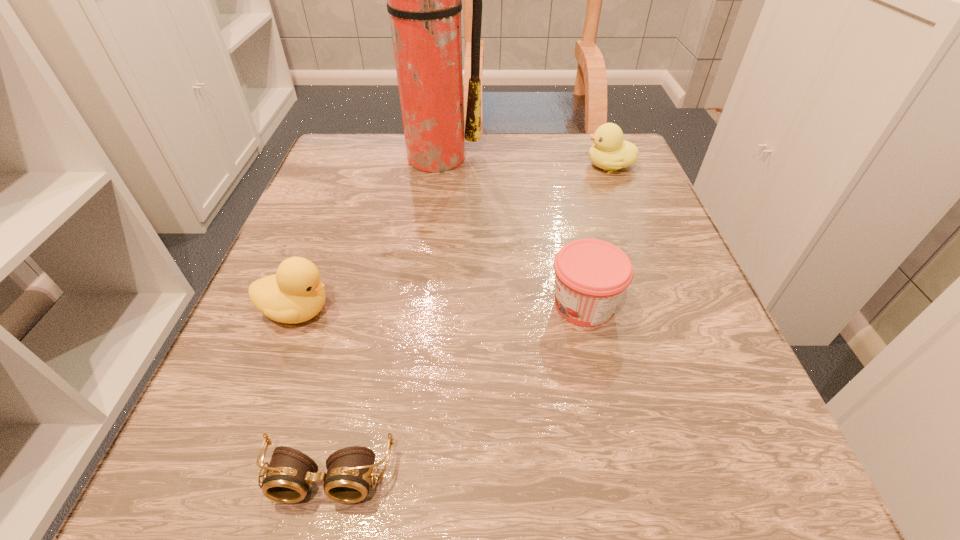
This screenshot has width=960, height=540. What are the coordinates of `duckling present at the right edge` in the screenshot? It's located at (610, 152).

The image size is (960, 540). I want to click on jam that is at the right edge, so click(591, 275).

At what (x,y) coordinates should I click in order to perform the action: click on object present at the far left corner. Please return your answer as a coordinate pair (x, y). The image size is (960, 540). Looking at the image, I should click on (424, 0).

Find the location of a particular element. Image resolution: width=960 pixels, height=540 pixels. object that is at the near left corner is located at coordinates (288, 478).

Locate an element on the screen. The height and width of the screenshot is (540, 960). object that is at the far right corner is located at coordinates click(610, 152).

The image size is (960, 540). In the image, there is a desktop. In order to click on free space at the far edge in this screenshot , I will do `click(493, 139)`.

At what (x,y) coordinates should I click in order to perform the action: click on free space at the near edge of the desktop. Please return your answer as a coordinate pair (x, y). Image resolution: width=960 pixels, height=540 pixels. Looking at the image, I should click on (431, 446).

This screenshot has width=960, height=540. What are the coordinates of `vacant space at the left edge of the desktop` in the screenshot? It's located at (340, 258).

Find the location of a particular element. This screenshot has width=960, height=540. free space at the right edge of the desktop is located at coordinates point(681,429).

I want to click on vacant space at the far left corner of the desktop, so click(335, 177).